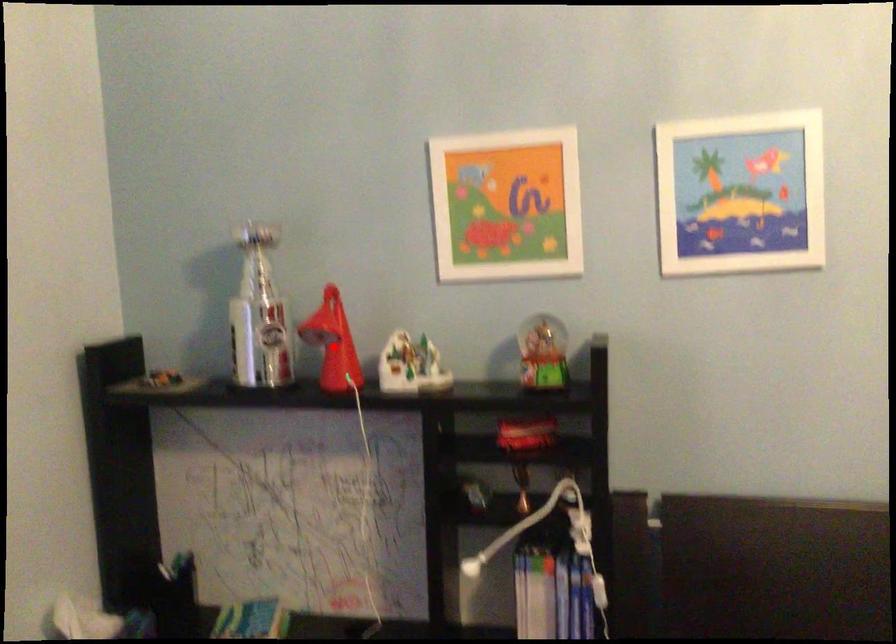
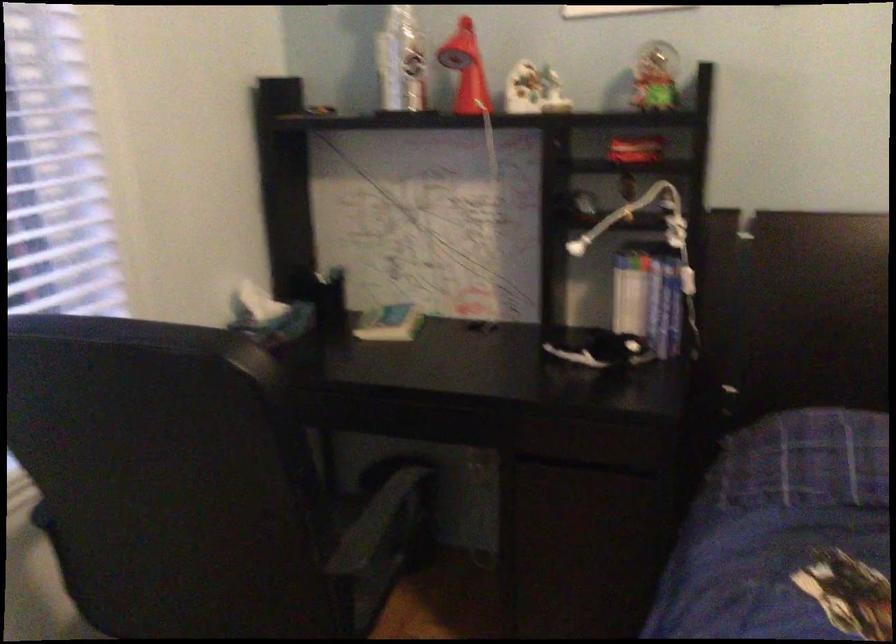
The point at the highlighted location is marked in the first image. Where is the corresponding point in the second image?

(466, 69)